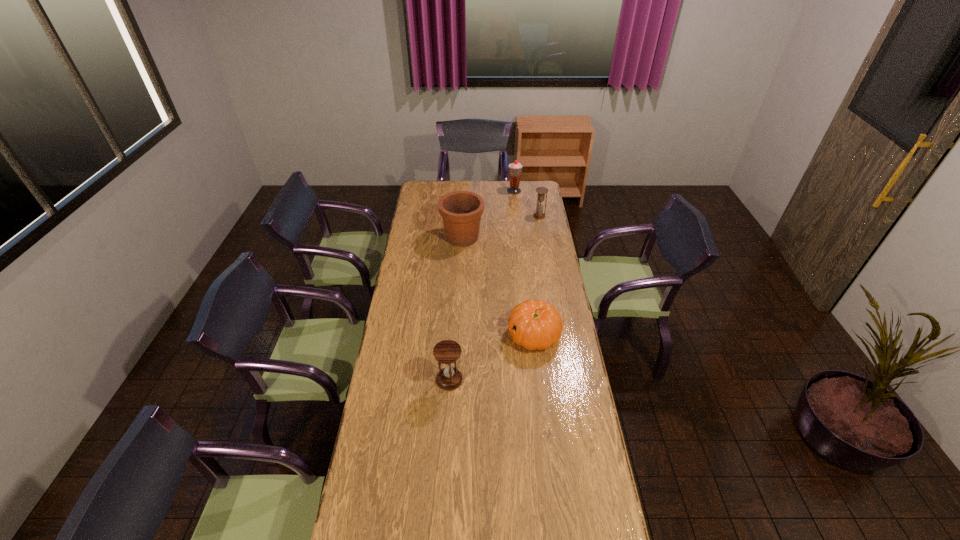
The image size is (960, 540). I want to click on smoothie, so click(x=515, y=168).

Locate an element on the screen. flowerpot is located at coordinates (461, 211).

Locate an element on the screen. the second farthest object is located at coordinates (541, 191).

Image resolution: width=960 pixels, height=540 pixels. I want to click on the right hourglass, so click(x=541, y=191).

Where is `the left hourglass`? The width and height of the screenshot is (960, 540). the left hourglass is located at coordinates (447, 352).

Identify the location of the nearest object. (447, 352).

Image resolution: width=960 pixels, height=540 pixels. What are the coordinates of `the fourth farthest object` in the screenshot? It's located at (534, 324).

In order to click on free space located on the front of the farthest object in this screenshot , I will do `click(517, 220)`.

Identify the location of vacant point located on the front of the third farthest object. The width and height of the screenshot is (960, 540). (460, 296).

At what (x,y) coordinates should I click in order to perform the action: click on free space located on the left of the right hourglass. Please return your answer as a coordinate pair (x, y). This screenshot has height=540, width=960. Looking at the image, I should click on (525, 216).